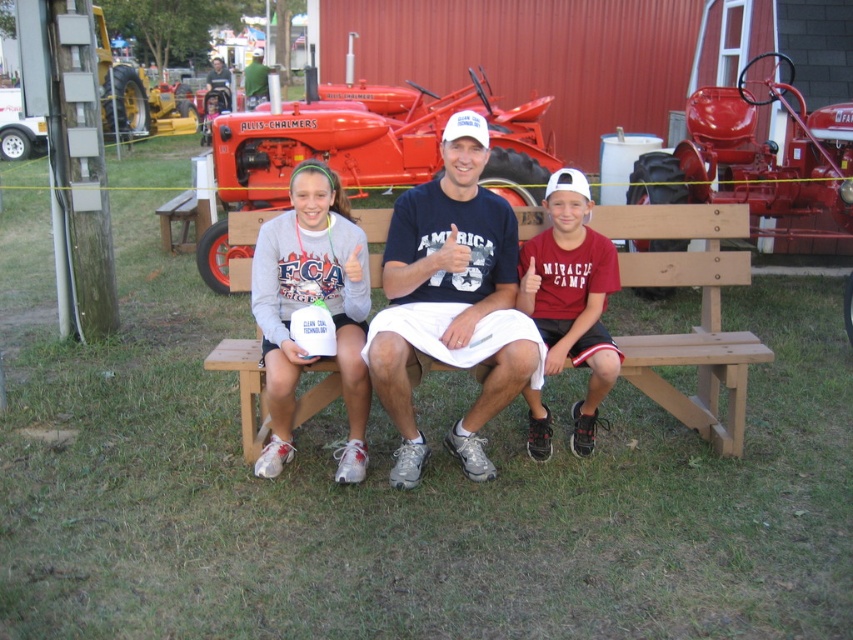
Is white cotton t-shirt at center above white matte cup at center?

Correct, white cotton t-shirt at center is located above white matte cup at center.

Is point (432, 186) closer to viewer compared to point (276, 368)?

No.

At what (x,y) coordinates should I click in order to perform the action: click on white cotton t-shirt at center. Please return your answer as a coordinate pair (x, y). The width and height of the screenshot is (853, 640). Looking at the image, I should click on (451, 301).

Locate an element on the screen. matte gray sweatshirt at center is located at coordinates (572, 296).

Who is positioned more to the right, matte gray sweatshirt at center or green fabric shirt at upper center?

From the viewer's perspective, matte gray sweatshirt at center appears more on the right side.

Who is more forward, (601, 298) or (248, 104)?

Positioned in front is point (601, 298).

Locate an element on the screen. The image size is (853, 640). matte gray sweatshirt at center is located at coordinates (572, 296).

Is red metal tractor at center taller than wooden bench at center?

Yes, red metal tractor at center is taller than wooden bench at center.

This screenshot has width=853, height=640. I want to click on red metal tractor at center, so click(x=375, y=141).

Image resolution: width=853 pixels, height=640 pixels. Find the location of `red metal tractor at center`. red metal tractor at center is located at coordinates pyautogui.click(x=375, y=141).